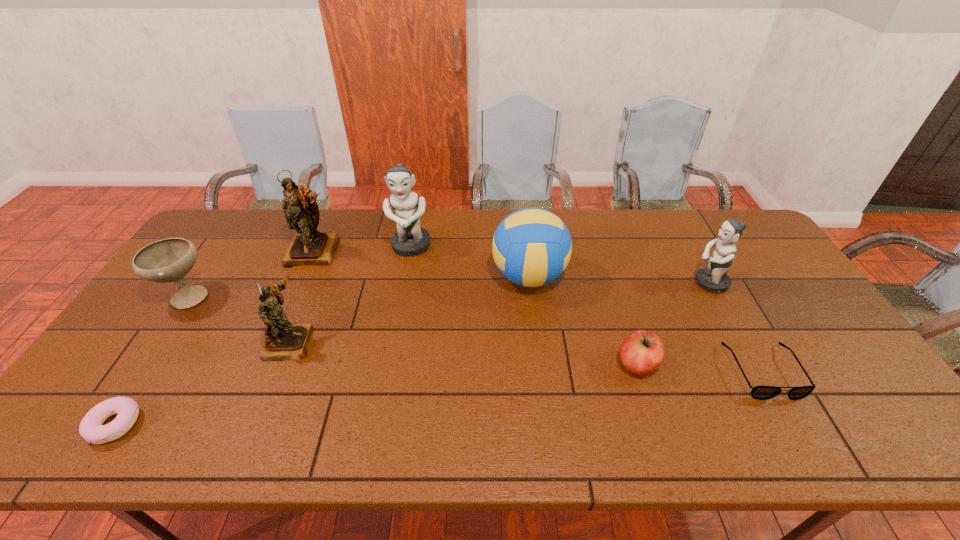
At what (x,y) coordinates should I click in order to perform the action: click on blank space at the far edge. Please return your answer as a coordinate pair (x, y). This screenshot has height=540, width=960. Looking at the image, I should click on (478, 235).

At what (x,y) coordinates should I click in order to perform the action: click on vacant position at the near edge of the desktop. Please return your answer as a coordinate pair (x, y). The image size is (960, 540). Looking at the image, I should click on point(723,427).

In the image, there is a desktop. Where is `vacant region at the right edge`? This screenshot has height=540, width=960. vacant region at the right edge is located at coordinates coord(826,401).

The image size is (960, 540). I want to click on empty space that is in between the left green figurine and the chalice, so click(300, 271).

In order to click on vacant area that lies between the black spectacles and the volleyball in this screenshot , I will do `click(646, 324)`.

I want to click on vacant space that is in between the apple and the third farthest figurine, so click(673, 323).

The width and height of the screenshot is (960, 540). In order to click on empty space between the sixth tallest object and the fifth object from left to right in this screenshot , I will do `click(300, 271)`.

This screenshot has width=960, height=540. In order to click on free spot between the farther gold figurine and the nearer gold figurine in this screenshot , I will do `click(301, 296)`.

I want to click on free point between the nearest object and the sixth tallest object, so point(152,360).

You are a GUI agent. You are given a task and a screenshot of the screen. Output one action in this format:
    pyautogui.click(x=<x>, y=<y>)
    Task: Click on the vacant space that's between the bigger gold figurine and the doughnut
    This screenshot has width=960, height=540.
    Given the screenshot: What is the action you would take?
    pyautogui.click(x=215, y=338)